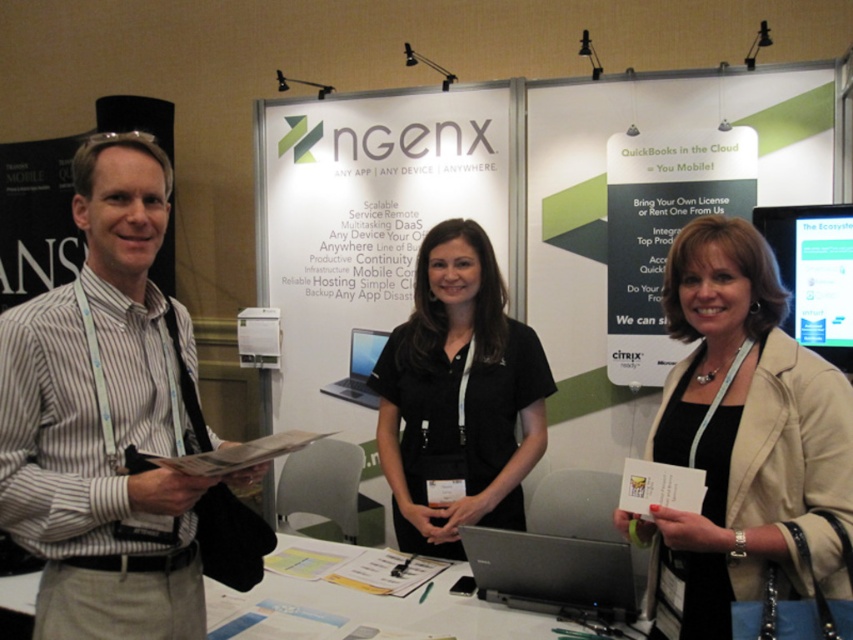
Which is above, white glossy table at center or matte black monitor at upper right?

matte black monitor at upper right is above.

Is white glossy table at center below matte black monitor at upper right?

Yes.

Find the location of a particular element. The image size is (853, 640). white glossy table at center is located at coordinates (387, 608).

Is black matte shirt at center taller than slate gray laptop at center?

Yes, black matte shirt at center is taller than slate gray laptop at center.

Is point (486, 305) positioned behind point (544, 545)?

Yes, it is.

Looking at this image, who is more distant from viewer, [486,513] or [549,605]?

Point [486,513]

Image resolution: width=853 pixels, height=640 pixels. I want to click on black matte shirt at center, so click(x=457, y=396).

Who is more forward, [440,579] or [502,536]?

Point [502,536]

Is white glossy table at center taller than slate gray laptop at center?

No.

Describe the element at coordinates (387, 608) in the screenshot. The image size is (853, 640). I see `white glossy table at center` at that location.

This screenshot has width=853, height=640. What are the coordinates of `white glossy table at center` in the screenshot? It's located at (387, 608).